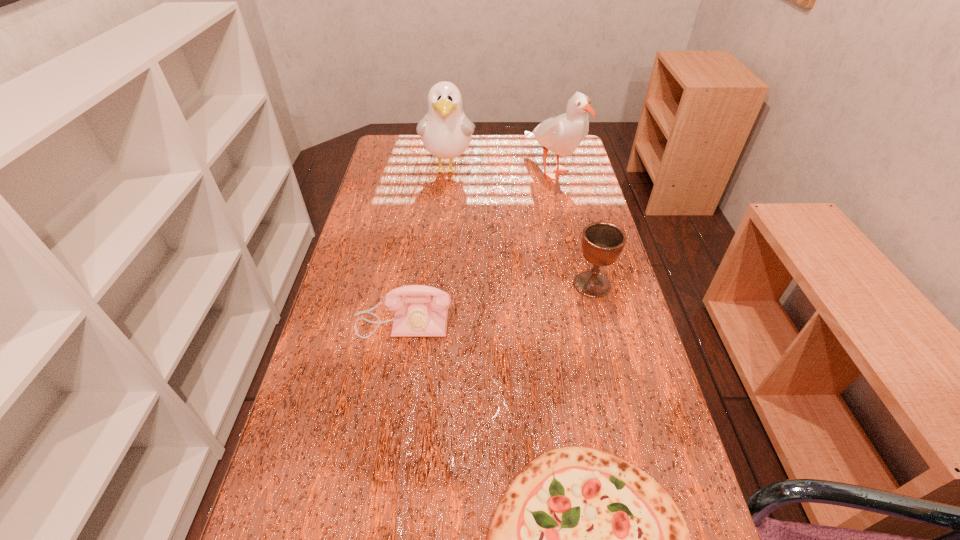
The image size is (960, 540). I want to click on vacant space in between the third shortest object and the left gull, so click(520, 226).

Locate an element on the screen. Image resolution: width=960 pixels, height=540 pixels. free space between the left gull and the fourth farthest object is located at coordinates (425, 245).

This screenshot has width=960, height=540. I want to click on free space between the third tallest object and the telephone, so click(x=497, y=303).

Identify the location of free space between the left gull and the third nearest object. Image resolution: width=960 pixels, height=540 pixels. (520, 226).

Identify the location of free spot between the left gull and the right gull. (500, 168).

Point out which object is positioned as the fourth nearest to the third farthest object. Please provide its 2D coordinates. Your answer should be formatted as a tuple, i.e. [(x, y)], where the tuple contains the x and y coordinates of a point satisfying the conditions above.

[(446, 132)]

You are a GUI agent. You are given a task and a screenshot of the screen. Output one action in this format:
    pyautogui.click(x=<x>, y=<y>)
    Task: Click on the closest object to the pizza
    This screenshot has width=960, height=540.
    Given the screenshot: What is the action you would take?
    pyautogui.click(x=420, y=310)

Identify the location of vacant area in the image that satisfies the following two spatial constraints: 1. at the beak of the right gull; 2. on the left side of the chalice. (577, 285).

Identify the location of free space that satisfies the following two spatial constraints: 1. on the beak of the chalice; 2. on the left side of the left gull. This screenshot has height=540, width=960. (437, 285).

You are a GUI agent. You are given a task and a screenshot of the screen. Output one action in this format:
    pyautogui.click(x=<x>, y=<y>)
    Task: Click on the free space that satisfies the following two spatial constraints: 1. at the beak of the right gull; 2. on the right side of the third nearest object
    Image resolution: width=960 pixels, height=540 pixels.
    Given the screenshot: What is the action you would take?
    pyautogui.click(x=577, y=285)